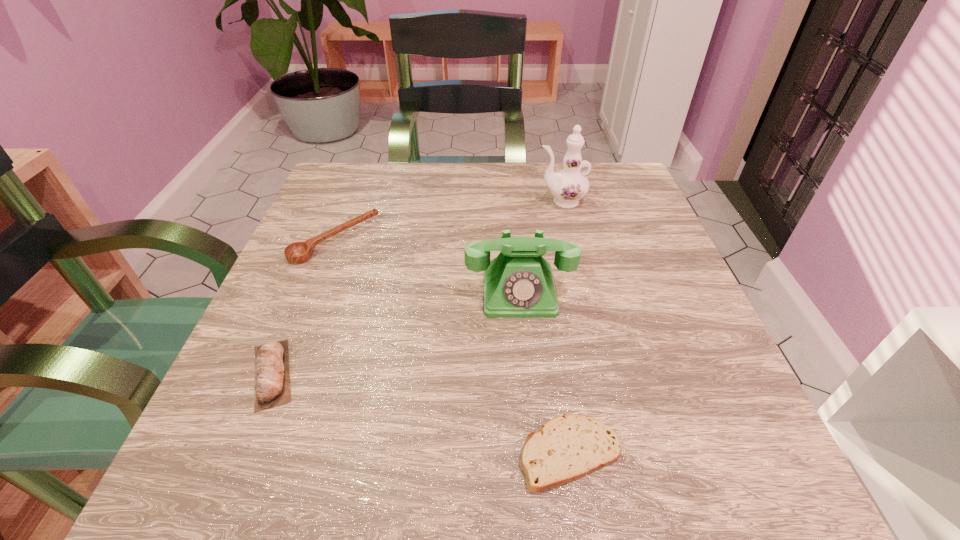
The height and width of the screenshot is (540, 960). Identify the location of unoccupied area between the farthest object and the farther pita bread. (417, 288).

In order to click on vacant space that is in between the wooden spoon and the second tallest object in this screenshot , I will do `click(427, 266)`.

You are a GUI agent. You are given a task and a screenshot of the screen. Output one action in this format:
    pyautogui.click(x=<x>, y=<y>)
    Task: Click on the free spot between the telephone and the fourth farthest object
    
    Given the screenshot: What is the action you would take?
    pyautogui.click(x=396, y=333)

Locate an element on the screen. vacant space in between the chinaware and the right pita bread is located at coordinates (565, 327).

I want to click on free area in between the nearer pita bread and the left pita bread, so click(x=420, y=414).

This screenshot has width=960, height=540. Find the location of `free space between the second nearest object and the nearer pita bread`. free space between the second nearest object and the nearer pita bread is located at coordinates (420, 414).

You are a GUI agent. You are given a task and a screenshot of the screen. Output one action in this format:
    pyautogui.click(x=<x>, y=<y>)
    Task: Click on the vacant space that is in between the telephone and the farther pita bread
    
    Given the screenshot: What is the action you would take?
    pyautogui.click(x=396, y=333)

Select which object is the third closest to the telephone. Please provide its 2D coordinates. Your answer should be formatted as a tuple, i.e. [(x, y)], where the tuple contains the x and y coordinates of a point satisfying the conditions above.

[(298, 252)]

At what (x,y) coordinates should I click in order to perform the action: click on the closest object to the chinaware. Please return your answer as a coordinate pair (x, y). This screenshot has height=540, width=960. Looking at the image, I should click on (518, 283).

Locate an element on the screen. This screenshot has height=540, width=960. vacant space that satisfies the following two spatial constraints: 1. on the front side of the shorter pita bread; 2. on the left side of the wooden spoon is located at coordinates (253, 453).